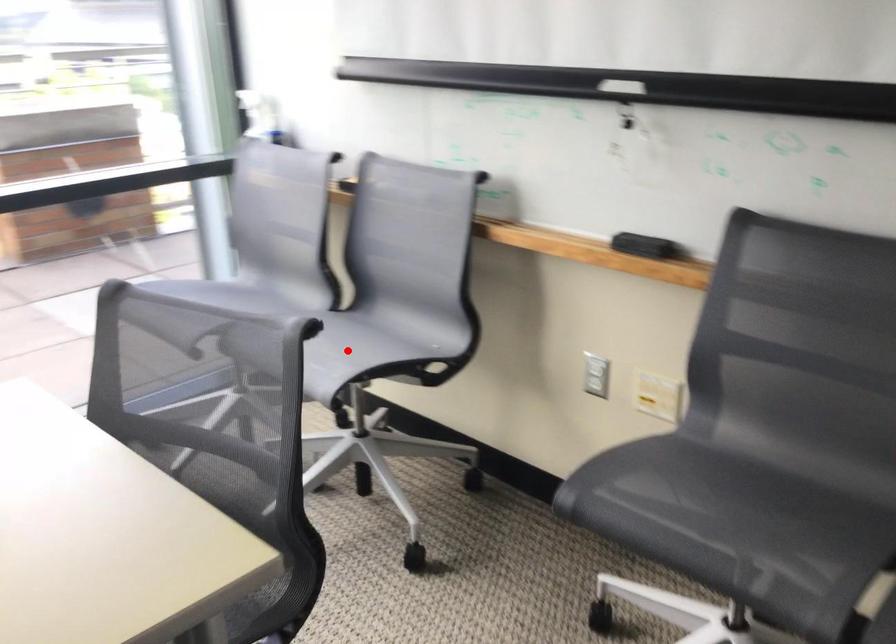
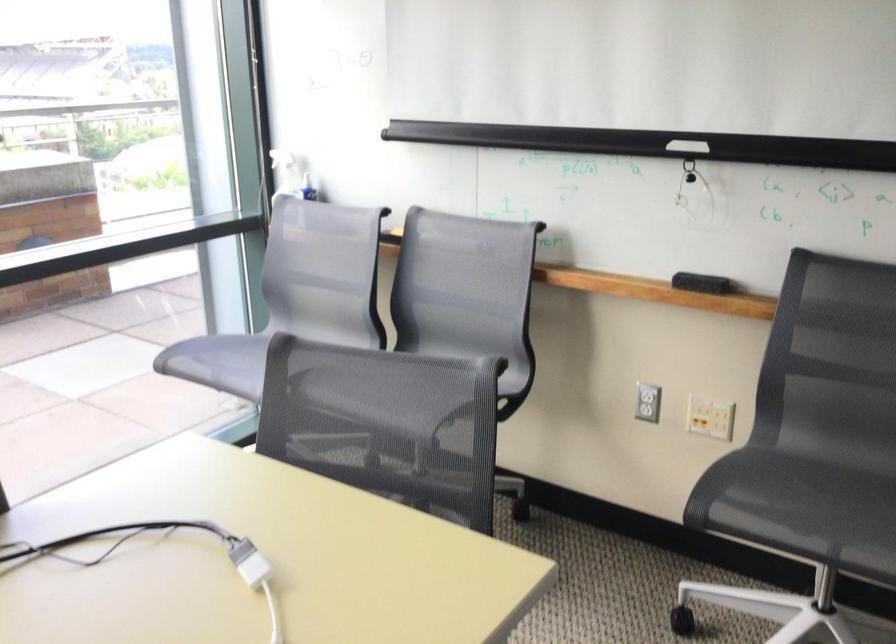
Question: I am providing you with two images of the same scene from different viewpoints. A red point is marked on the first image. Is the red point's position out of view in image 2?

Choices:
 (A) Yes
 (B) No

Answer: (A)